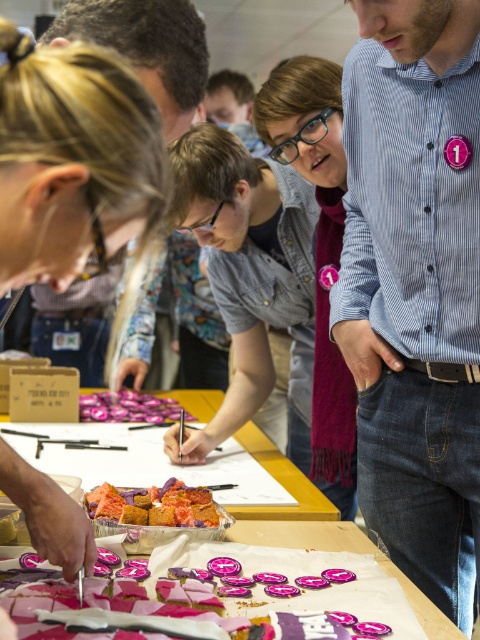
You are standing at the origin point of the coordinate system in the image. You want to move towards the blue striped shirt at center. What direction should you move in to reach it?

The blue striped shirt at center is located at coordinates point (416, 285), so you should move towards the right and downward direction to reach it.

You are standing 3 feet away from the table in the scene. Can you reach the point at coordinates [464,272] without moving closer?

The distance of point [464,272] from viewer is 3.46 feet. Since you are 3 feet away, you are 0.46 feet too far to reach it without moving closer.